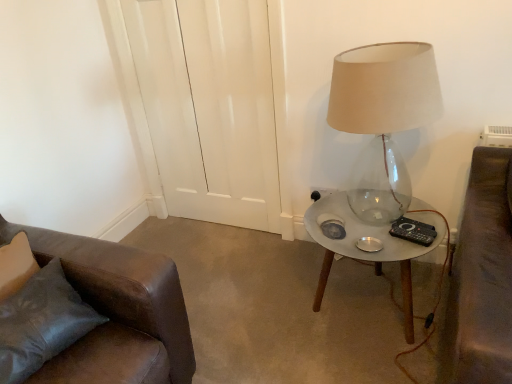
Find the location of a particular element. free space to the left of black plastic remote control at right is located at coordinates (377, 233).